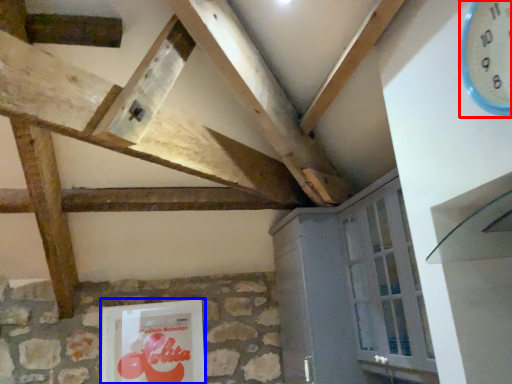
Question: Among these objects, which one is nearest to the camera, clock (highlighted by a red box) or picture frame (highlighted by a blue box)?

Choices:
 (A) clock
 (B) picture frame

Answer: (A)